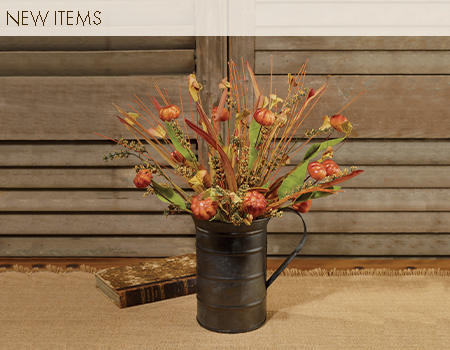
You are a GUI agent. You are given a task and a screenshot of the screen. Output one action in this format:
    pyautogui.click(x=<x>, y=<y>)
    Task: Click on the dried plant pods
    
    Given the screenshot: What is the action you would take?
    pyautogui.click(x=199, y=206), pyautogui.click(x=250, y=201), pyautogui.click(x=323, y=172), pyautogui.click(x=263, y=114)